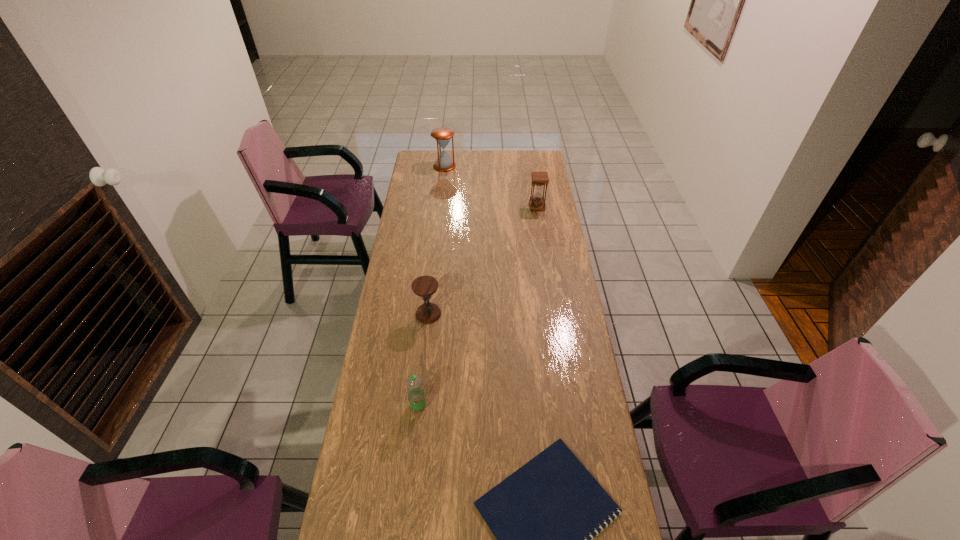
Locate an element on the screen. The image size is (960, 540). water bottle present at the left edge is located at coordinates (416, 395).

The height and width of the screenshot is (540, 960). Find the location of `object that is at the right edge`. object that is at the right edge is located at coordinates (537, 202).

Find the location of a particular element. The image size is (960, 540). object that is at the far left corner is located at coordinates (442, 135).

In the image, there is a desktop. In order to click on vacant area at the far edge in this screenshot , I will do `click(516, 151)`.

At what (x,y) coordinates should I click in order to perform the action: click on vacant region at the left edge of the desktop. Please return your answer as a coordinate pair (x, y). The image size is (960, 540). Looking at the image, I should click on (398, 301).

In the image, there is a desktop. Where is `free region at the right edge`? This screenshot has height=540, width=960. free region at the right edge is located at coordinates (552, 277).

This screenshot has height=540, width=960. What are the coordinates of `free space at the far left corner` in the screenshot? It's located at (419, 157).

This screenshot has width=960, height=540. I want to click on vacant point at the far right corner, so click(532, 163).

Locate an element on the screen. empty space that is in between the nearest hourglass and the farthest object is located at coordinates (437, 240).

Find the location of a particular element. The height and width of the screenshot is (540, 960). unoccupied position between the farthest object and the third farthest object is located at coordinates (437, 240).